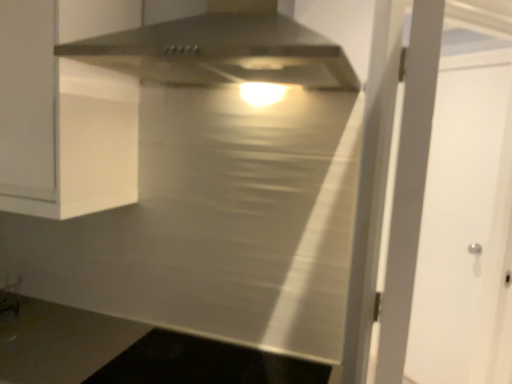
In order to face white matte door at right, should I rotate leftwards or rightwards?

Turn right approximately 24.819 degrees to face it.

Locate an element on the screen. stainless steel range hood at upper center is located at coordinates (221, 52).

From a real-world perspective, which object rests below the other?

white matte door at right, from a real-world perspective.

Relative to white matte door at right, is stainless steel range hood at upper center in front or behind?

stainless steel range hood at upper center is in front of white matte door at right.

From the picture: Considering the sizes of stainless steel range hood at upper center and white matte door at right in the image, is stainless steel range hood at upper center taller or shorter than white matte door at right?

In the image, stainless steel range hood at upper center appears to be shorter than white matte door at right.

Can you confirm if stainless steel range hood at upper center is bigger than white matte door at right?

Indeed, stainless steel range hood at upper center has a larger size compared to white matte door at right.

From a real-world perspective, is black glass cooktop at lower center physically below stainless steel range hood at upper center?

Yes.

From the image's perspective, which one is positioned higher, black glass cooktop at lower center or stainless steel range hood at upper center?

stainless steel range hood at upper center, from the image's perspective.

Considering the sizes of objects black glass cooktop at lower center and stainless steel range hood at upper center in the image provided, who is taller, black glass cooktop at lower center or stainless steel range hood at upper center?

With more height is stainless steel range hood at upper center.

Is black glass cooktop at lower center wider than stainless steel range hood at upper center?

No.

Considering the positions of points (510, 192) and (311, 86), is point (510, 192) closer to camera compared to point (311, 86)?

No, (510, 192) is further to viewer.

From the image's perspective, would you say white matte door at right is shown under stainless steel range hood at upper center?

Yes.

Is white matte door at right thinner than stainless steel range hood at upper center?

Correct, the width of white matte door at right is less than that of stainless steel range hood at upper center.

How distant is white matte door at right from stainless steel range hood at upper center?

A distance of 5.13 feet exists between white matte door at right and stainless steel range hood at upper center.

From the picture: Which object is positioned more to the left, black glass cooktop at lower center or white matte door at right?

black glass cooktop at lower center.

From the image's perspective, is black glass cooktop at lower center located above white matte door at right?

No, from the image's perspective, black glass cooktop at lower center is not over white matte door at right.

Considering the positions of objects black glass cooktop at lower center and white matte door at right in the image provided, who is behind, black glass cooktop at lower center or white matte door at right?

Positioned behind is white matte door at right.

Is black glass cooktop at lower center facing towards white matte door at right?

No, black glass cooktop at lower center is not facing towards white matte door at right.

Is point (449, 292) in front of point (101, 377)?

No, it is behind (101, 377).

Could you tell me if white matte door at right is turned towards black glass cooktop at lower center?

No, white matte door at right is not facing towards black glass cooktop at lower center.

Is white matte door at right taller than black glass cooktop at lower center?

Indeed, white matte door at right has a greater height compared to black glass cooktop at lower center.

Considering the relative sizes of white matte door at right and black glass cooktop at lower center in the image provided, is white matte door at right smaller than black glass cooktop at lower center?

No.

Which is behind, stainless steel range hood at upper center or black glass cooktop at lower center?

black glass cooktop at lower center is further away from the camera.

From a real-world perspective, is stainless steel range hood at upper center on top of black glass cooktop at lower center?

Correct, in the physical world, stainless steel range hood at upper center is higher than black glass cooktop at lower center.

Is point (274, 40) positioned behind point (266, 370)?

No, it is in front of (266, 370).

The image size is (512, 384). I want to click on home appliance located above the black glass cooktop at lower center (from the image's perspective), so click(221, 52).

In the image, there is a white matte door at right. Find the location of `home appliance above it (from the image's perspective)`. home appliance above it (from the image's perspective) is located at coordinates (221, 52).

I want to click on home appliance above the black glass cooktop at lower center (from a real-world perspective), so click(x=221, y=52).

When comparing their distances from white matte door at right, does stainless steel range hood at upper center or black glass cooktop at lower center seem closer?

The object closer to white matte door at right is black glass cooktop at lower center.

Consider the image. Based on their spatial positions, is black glass cooktop at lower center or white matte door at right further from stainless steel range hood at upper center?

Among the two, white matte door at right is located further to stainless steel range hood at upper center.

From the picture: Looking at the image, which one is located further to black glass cooktop at lower center, stainless steel range hood at upper center or white matte door at right?

Among the two, white matte door at right is located further to black glass cooktop at lower center.

From the image, which object appears to be farther from white matte door at right, black glass cooktop at lower center or stainless steel range hood at upper center?

stainless steel range hood at upper center is positioned further to the anchor white matte door at right.

From the picture: Considering their positions, is white matte door at right positioned closer to stainless steel range hood at upper center than black glass cooktop at lower center?

black glass cooktop at lower center is positioned closer to the anchor stainless steel range hood at upper center.

Estimate the real-world distances between objects in this image. Which object is closer to black glass cooktop at lower center, white matte door at right or stainless steel range hood at upper center?

Among the two, stainless steel range hood at upper center is located nearer to black glass cooktop at lower center.

Locate an element on the screen. This screenshot has width=512, height=384. dark between stainless steel range hood at upper center and white matte door at right along the z-axis is located at coordinates (204, 363).